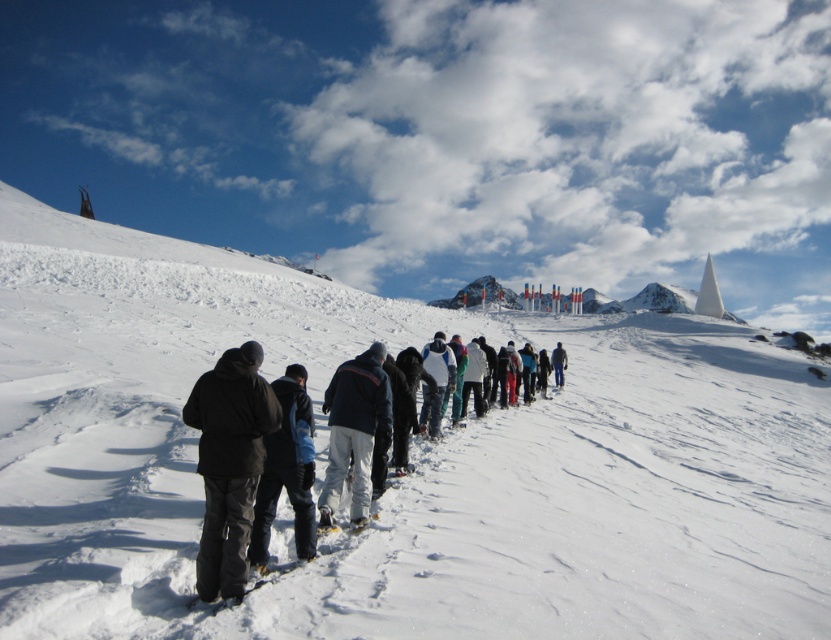
Which of these two, white powdery snow at center or black matte jacket at lower left, stands shorter?

With less height is black matte jacket at lower left.

Is white powdery snow at center smaller than black matte jacket at lower left?

Incorrect, white powdery snow at center is not smaller in size than black matte jacket at lower left.

Does point (647, 612) come closer to viewer compared to point (210, 564)?

No, (647, 612) is further to viewer.

Find the location of `white powdery snow at center`. white powdery snow at center is located at coordinates (411, 460).

From the picture: Can you confirm if dark gray pants at center is thinner than white matte snow pants at center?

No, dark gray pants at center is not thinner than white matte snow pants at center.

Is dark gray pants at center positioned behind white matte snow pants at center?

No.

This screenshot has height=640, width=831. Identify the location of dark gray pants at center. (298, 464).

The width and height of the screenshot is (831, 640). In order to click on dark gray pants at center in this screenshot , I will do `click(298, 464)`.

Which is more to the right, white powdery snow at center or white matte snow pants at center?

Positioned to the right is white matte snow pants at center.

Is white powdery snow at center behind white matte snow pants at center?

That is False.

Measure the distance between white powdery snow at center and camera.

7.85 meters

The width and height of the screenshot is (831, 640). In order to click on white powdery snow at center in this screenshot , I will do `click(411, 460)`.